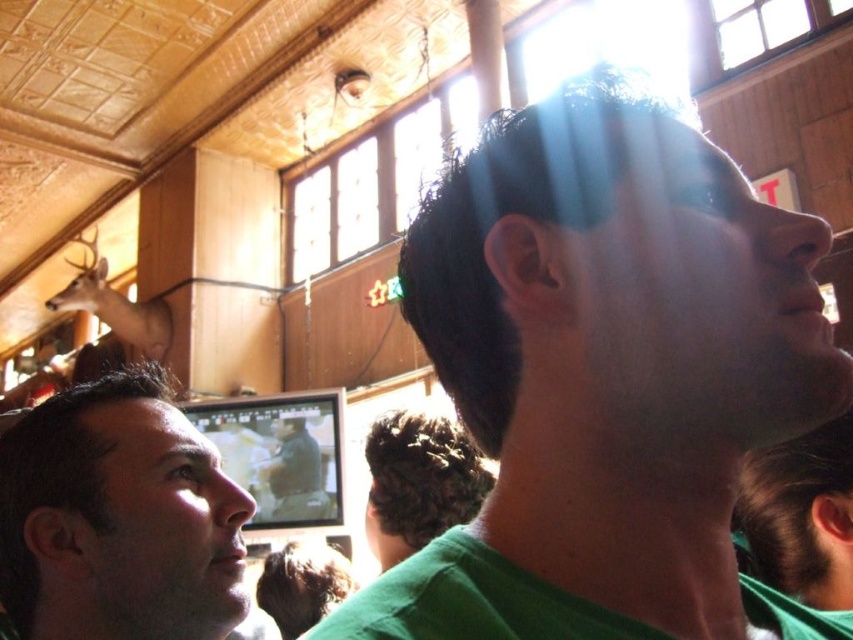
Looking at this image, you are planning to place a new decorative item between the brown matte deer at upper left and the matte brown deer at center. Based on their widths, which deer should be the reference point for the placement to ensure the new item fits?

The brown matte deer at upper left might be wider than the matte brown deer at center, so you should use the width of the brown matte deer at upper left as the reference point to ensure the new item fits properly.

You are at a bar and want to order a drink. You see a brown matte deer at upper left and a matte brown deer at center. Which deer is closer to the right side of the room?

The matte brown deer at center is closer to the right side of the room because the brown matte deer at upper left is positioned to its left.